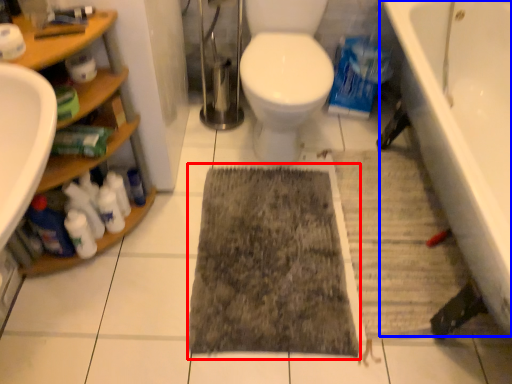
Question: Which point is further to the camera, doormat (highlighted by a red box) or bathtub (highlighted by a blue box)?

Choices:
 (A) doormat
 (B) bathtub

Answer: (A)